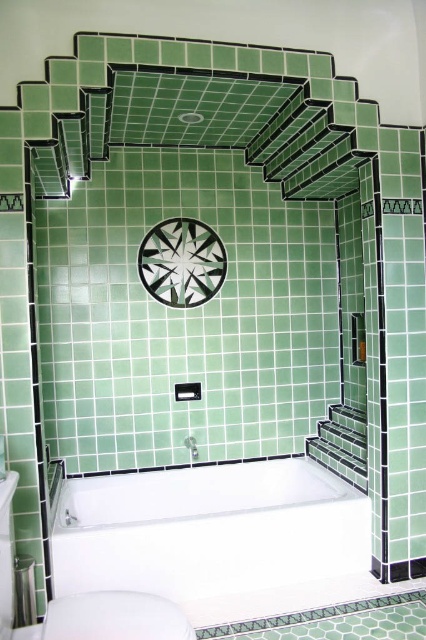
Between white glossy sink at lower left and white glossy shower head at upper center, which one appears on the left side from the viewer's perspective?

white glossy sink at lower left is more to the left.

Who is more distant from viewer, (57,600) or (189,436)?

The point (189,436) is more distant.

The width and height of the screenshot is (426, 640). I want to click on white glossy sink at lower left, so click(x=94, y=612).

Which of these two, white glossy bathtub at center or white glossy shower head at upper center, stands shorter?

With less height is white glossy shower head at upper center.

Describe the element at coordinates (216, 538) in the screenshot. I see `white glossy bathtub at center` at that location.

Locate an element on the screen. The image size is (426, 640). white glossy bathtub at center is located at coordinates (216, 538).

Is white glossy toilet bowl at lower center taller than white glossy shower head at upper center?

No.

Does point (43, 627) come closer to viewer compared to point (186, 442)?

Yes.

Between point (46, 625) and point (184, 445), which one is positioned in front?

Point (46, 625) is in front.

The image size is (426, 640). Find the location of `white glossy toilet bowl at lower center`. white glossy toilet bowl at lower center is located at coordinates (115, 618).